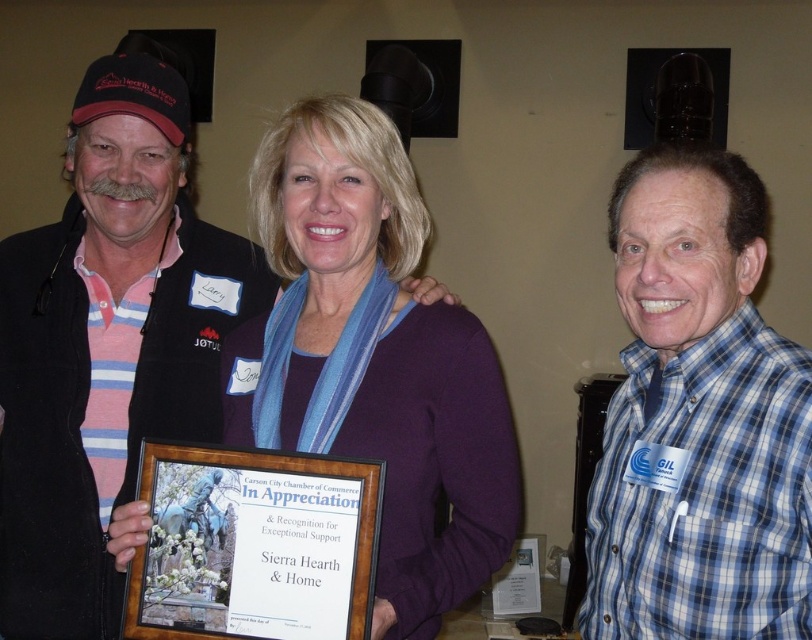
You are standing in the room and want to hand a gift to the person wearing the purple fabric scarf at center. Which direction should you move to get closer to them compared to the blue plaid shirt at right?

The blue plaid shirt at right is closer to the viewer than the purple fabric scarf at center, so to get closer to the purple fabric scarf at center, you should move backward to increase the distance between you and the blue plaid shirt at right while maintaining your position relative to the purple fabric scarf at center.

Based on the scene description, which object is positioned higher relative to the other? Please refer to the objects listed below and answer accordingly. Objects to consider are the striped polo shirt at left and the purple fabric scarf at center.

The striped polo shirt at left is located above the purple fabric scarf at center, so the striped polo shirt at left is positioned higher.